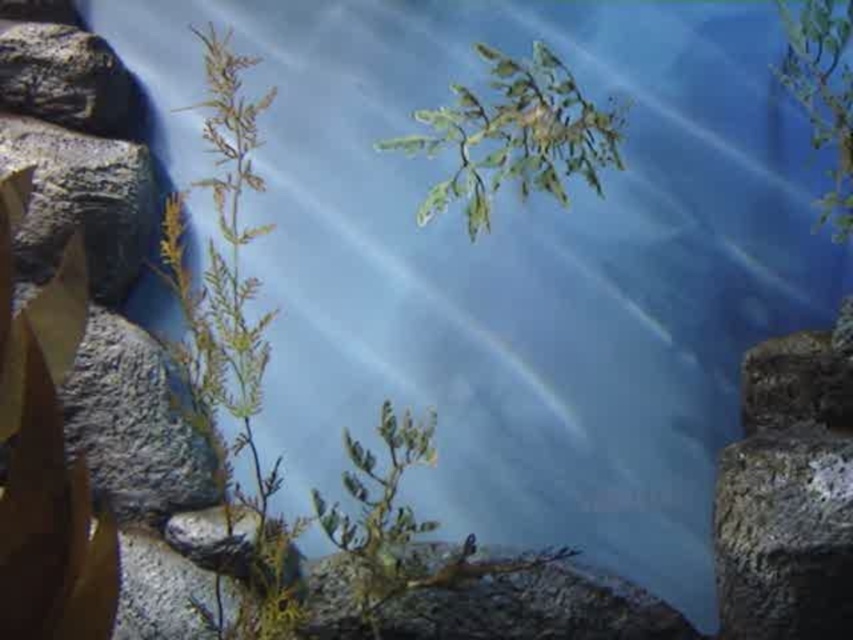
Question: Which of these objects is positioned farthest from the green leafy plant at upper center?

Choices:
 (A) green leafy plant at upper right
 (B) rough textured rock at right
 (C) rough gray rock at upper left
 (D) rough gray rock at left

Answer: (C)

Question: Can you confirm if rough gray rock at left is positioned to the left of green leafy plant at upper right?

Choices:
 (A) no
 (B) yes

Answer: (B)

Question: Can you confirm if green leafy plant at upper center is positioned above gray rough stone at left?

Choices:
 (A) yes
 (B) no

Answer: (A)

Question: Based on their relative distances, which object is farther from the rough gray rock at upper left?

Choices:
 (A) green leafy plant at upper center
 (B) green leafy plant at upper right
 (C) rough textured rock at right

Answer: (C)

Question: Does rough textured rock at right appear over rough gray rock at upper left?

Choices:
 (A) yes
 (B) no

Answer: (B)

Question: Which object appears closest to the camera in this image?

Choices:
 (A) gray rough stone at left
 (B) rough gray rock at upper left

Answer: (A)